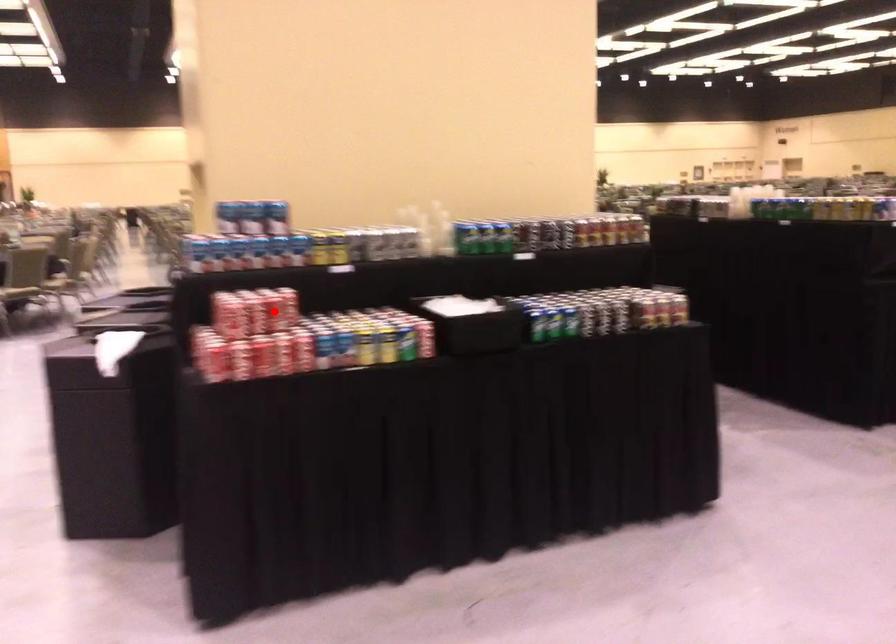
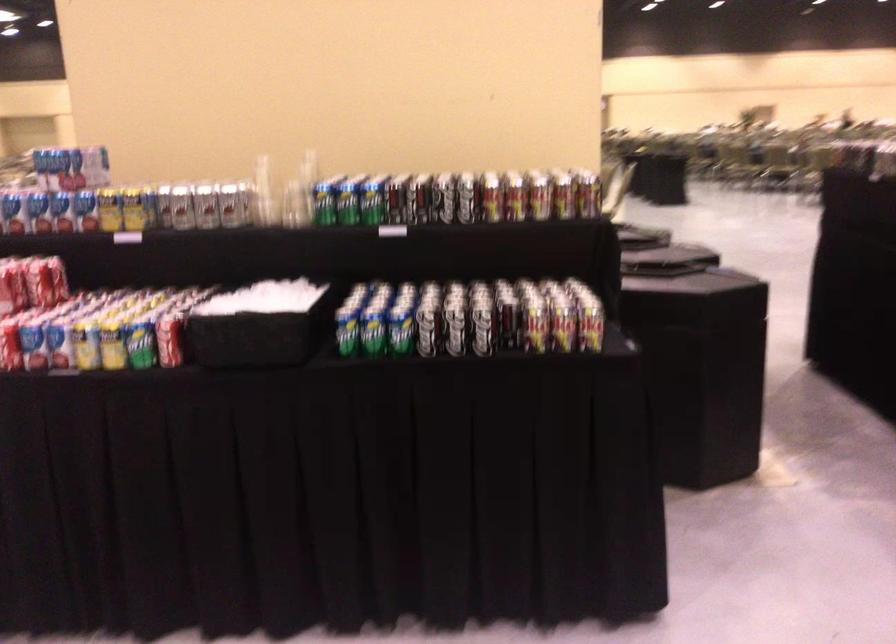
Question: I am providing you with two images of the same scene from different viewpoints. Given a red point in image1, look at the same physical point in image2. Is it:

Choices:
 (A) Closer to the viewpoint
 (B) Farther from the viewpoint

Answer: (A)